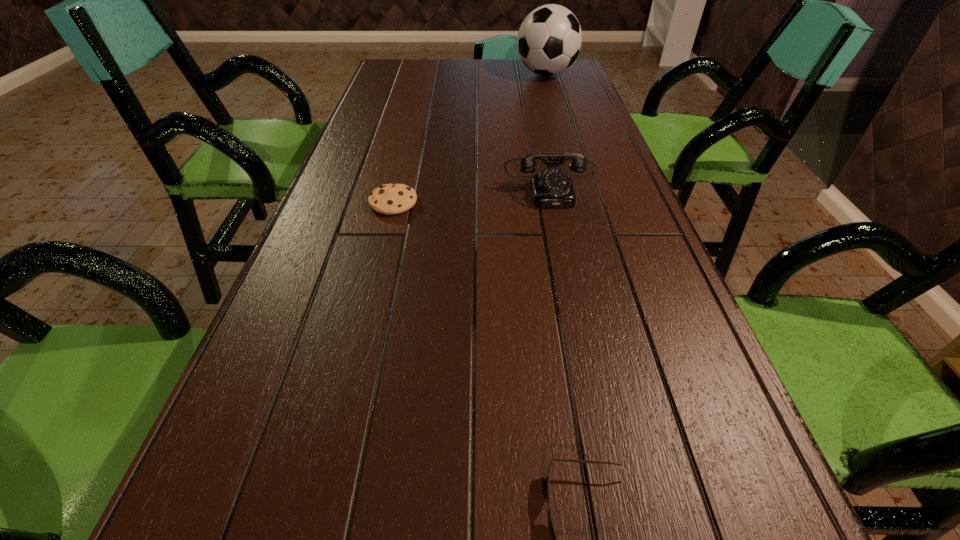
This screenshot has height=540, width=960. Find the location of `soccer ball that is at the right edge`. soccer ball that is at the right edge is located at coordinates (549, 39).

Image resolution: width=960 pixels, height=540 pixels. I want to click on telephone that is at the right edge, so click(552, 187).

Find the location of a particular element. The width and height of the screenshot is (960, 540). object located in the far right corner section of the desktop is located at coordinates (549, 39).

Where is `free space at the far edge`? This screenshot has height=540, width=960. free space at the far edge is located at coordinates (429, 62).

I want to click on vacant space at the left edge of the desktop, so click(387, 89).

The image size is (960, 540). In order to click on free space at the right edge of the desktop in this screenshot , I will do `click(669, 340)`.

Locate an element on the screen. The image size is (960, 540). vacant space at the far left corner of the desktop is located at coordinates (396, 83).

Find the location of a particular element. free area in between the third shortest object and the tallest object is located at coordinates (549, 128).

This screenshot has width=960, height=540. I want to click on vacant point located between the telephone and the tallest object, so click(549, 128).

Locate an element on the screen. The image size is (960, 540). free spot between the third shortest object and the cookie is located at coordinates (472, 192).